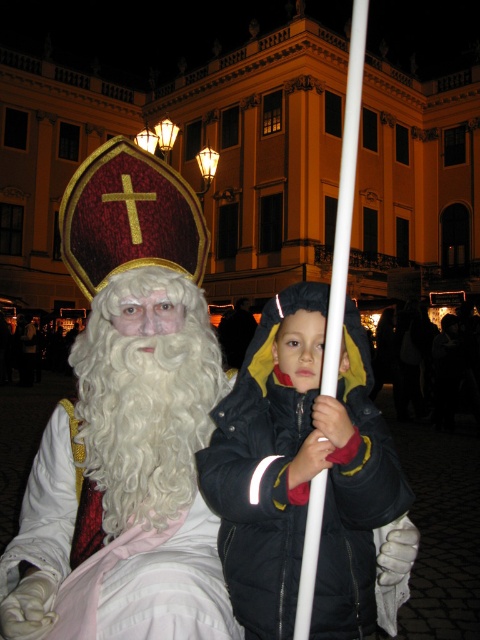
Does velvet gold hat at center appear over white plastic pole at center?

Actually, velvet gold hat at center is below white plastic pole at center.

Does point (184, 550) lie in front of point (321, 522)?

No, (184, 550) is further to viewer.

At what (x,y) coordinates should I click in order to perform the action: click on velvet gold hat at center. Please return your answer as a coordinate pair (x, y). Looking at the image, I should click on (126, 426).

Is black puffy coat at center above white curly beard at center?

No, black puffy coat at center is not above white curly beard at center.

Is black puffy coat at center thinner than white curly beard at center?

Incorrect, black puffy coat at center's width is not less than white curly beard at center's.

Is point (349, 324) farther from camera compared to point (106, 323)?

No, (349, 324) is in front of (106, 323).

The width and height of the screenshot is (480, 640). Find the location of `black puffy coat at center`. black puffy coat at center is located at coordinates (300, 472).

Between point (372, 547) and point (316, 492), which one is positioned behind?

Point (372, 547)

Is point (282, 301) positioned after point (336, 282)?

Yes, point (282, 301) is farther from viewer.

At what (x,y) coordinates should I click in order to perform the action: click on black puffy coat at center. Please return your answer as a coordinate pair (x, y). Looking at the image, I should click on (300, 472).